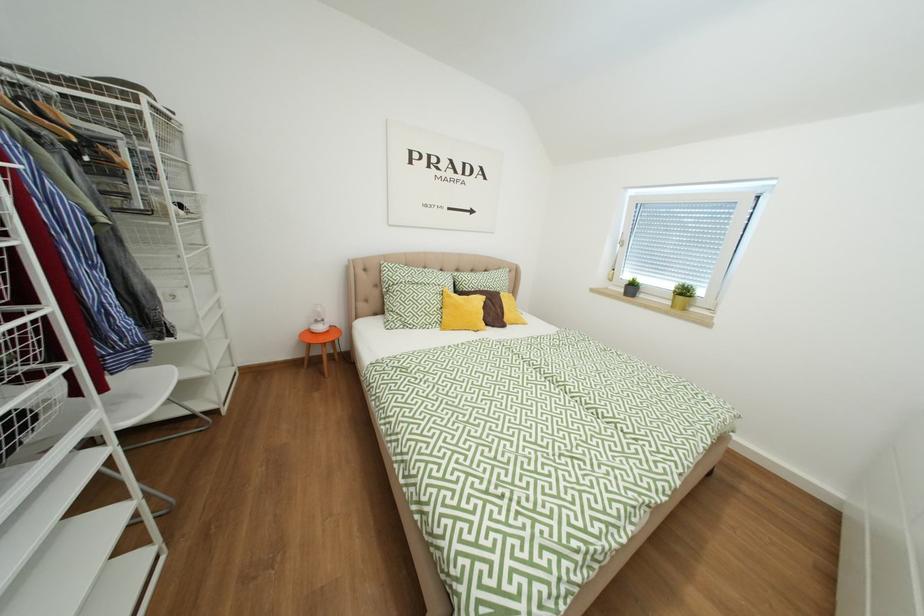
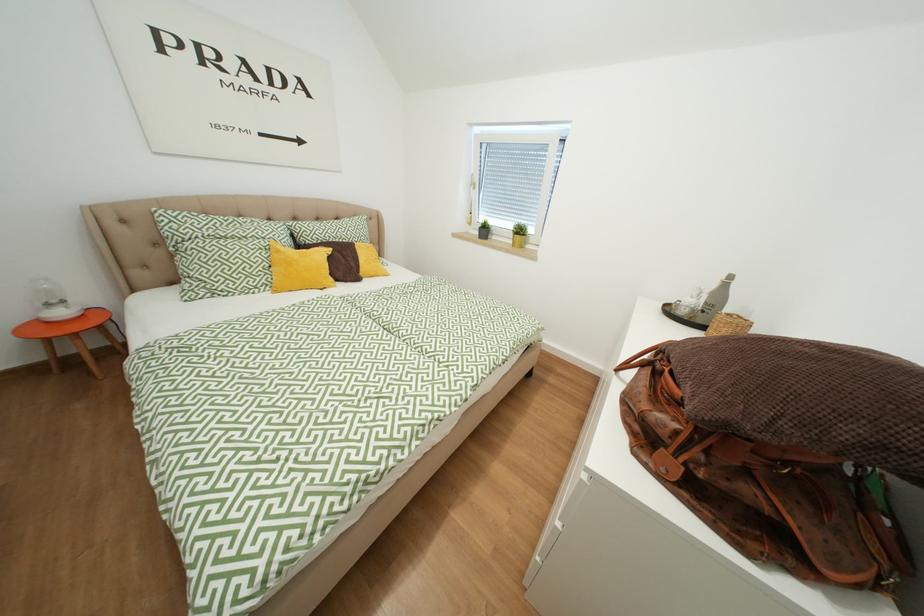
Question: The images are taken continuously from a first-person perspective. In which direction is your viewpoint rotating?

Choices:
 (A) Left
 (B) Right
 (C) Up
 (D) Down

Answer: (B)